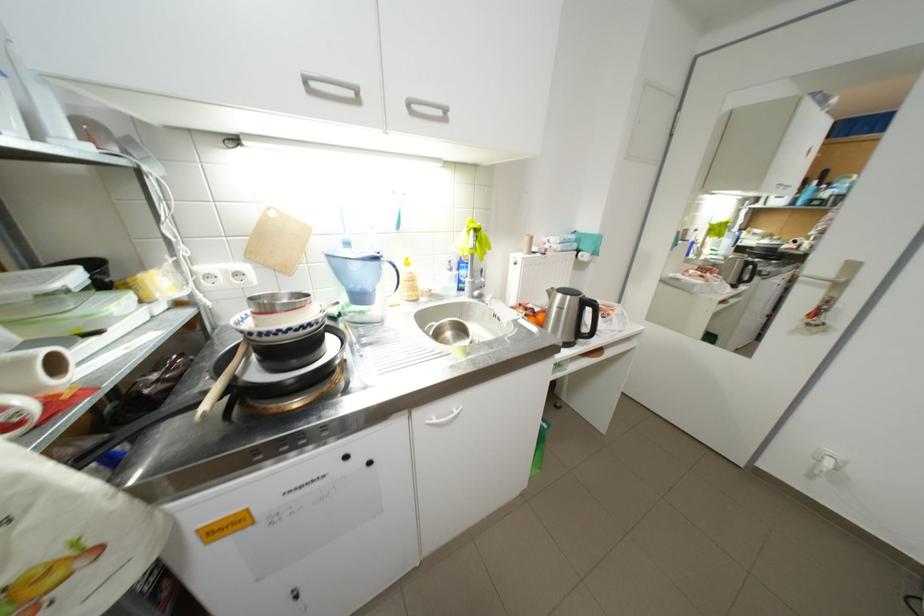
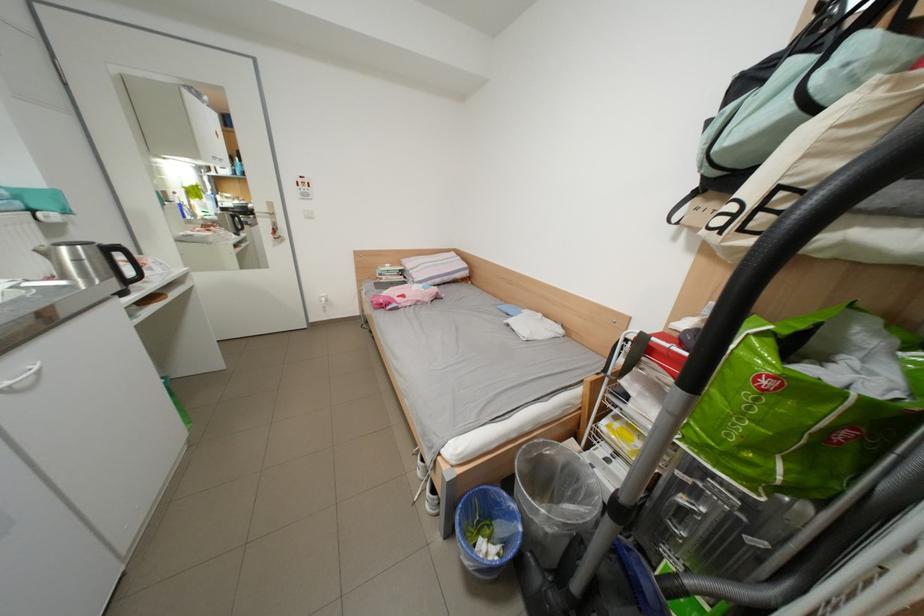
In the second image, find the point that corresponds to the point at 468,413 in the first image.

(46, 369)